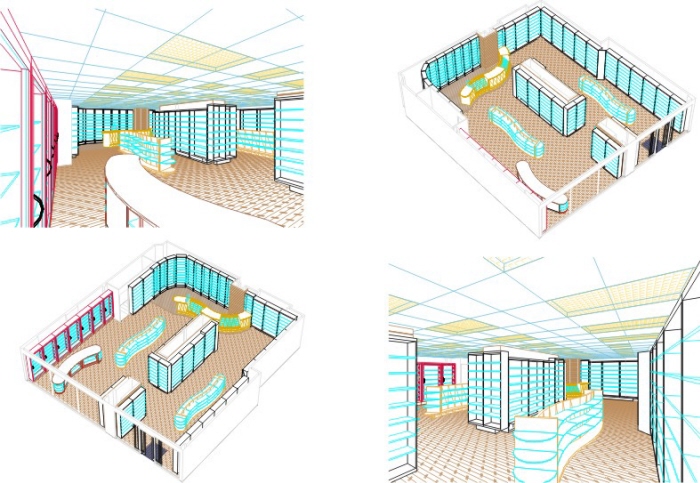
Identify the location of floor. (239, 195).